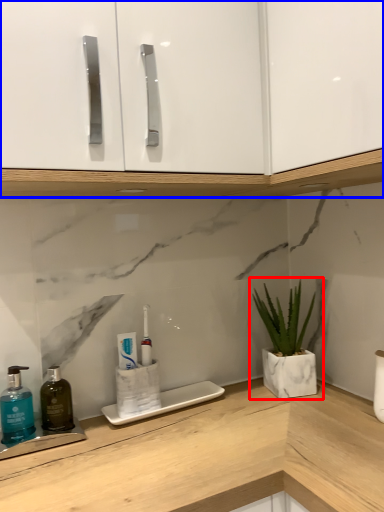
Question: Which point is closer to the camera, houseplant (highlighted by a red box) or cabinetry (highlighted by a blue box)?

Choices:
 (A) houseplant
 (B) cabinetry

Answer: (B)